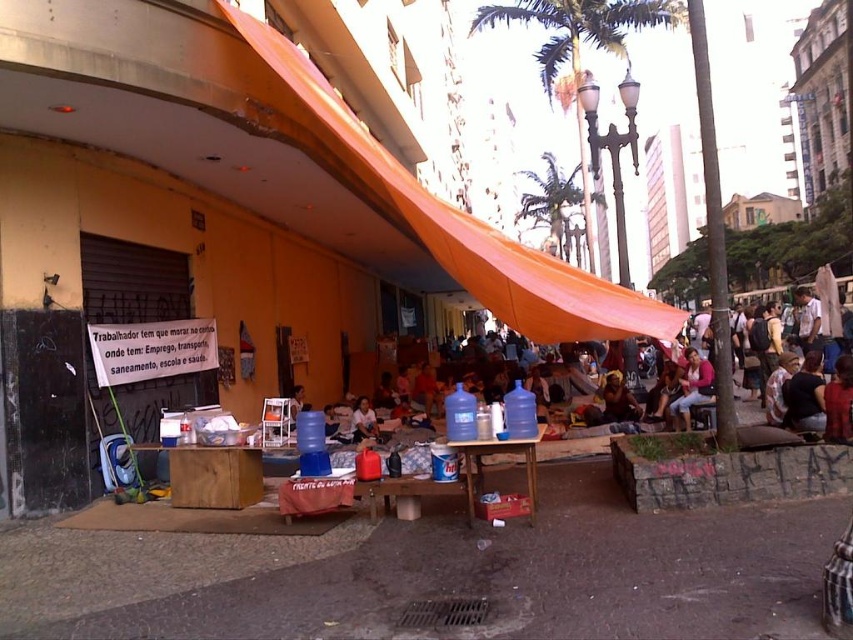
Which is below, wooden table at center or dark blue shirt at center?

wooden table at center is lower down.

Measure the distance between wooden table at center and camera.

The distance of wooden table at center from camera is 5.45 meters.

The image size is (853, 640). I want to click on wooden table at center, so click(x=496, y=452).

Does dark blue shirt at center have a greater width compared to smooth plastic bottle at center?

Correct, the width of dark blue shirt at center exceeds that of smooth plastic bottle at center.

Which is behind, point (824, 426) or point (369, 413)?

Positioned behind is point (369, 413).

Find the location of `dark blue shirt at center`. dark blue shirt at center is located at coordinates (805, 396).

Which is in front, point (515, 442) or point (612, 392)?

Positioned in front is point (515, 442).

Does wooden table at center come in front of brown leather jacket at center?

That is True.

Does point (469, 452) come in front of point (619, 372)?

Yes, point (469, 452) is in front of point (619, 372).

The width and height of the screenshot is (853, 640). Identify the location of wooden table at center. (496, 452).